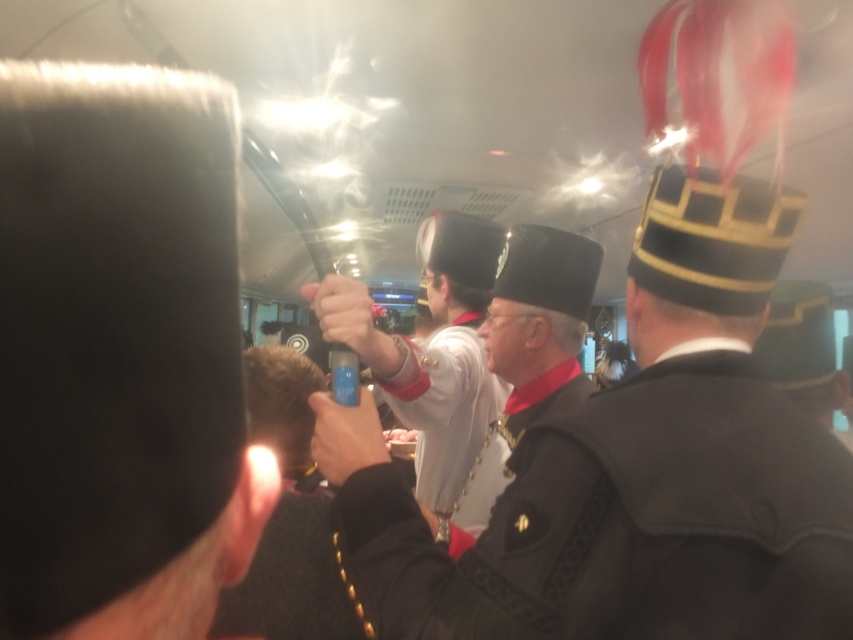
Question: Does metallic silver can at center have a larger size compared to black matte uniform at center?

Choices:
 (A) no
 (B) yes

Answer: (B)

Question: Is metallic silver can at center to the right of black felt hat at center from the viewer's perspective?

Choices:
 (A) yes
 (B) no

Answer: (B)

Question: Which of the following is the farthest from the observer?

Choices:
 (A) (321, 282)
 (B) (735, 289)

Answer: (A)

Question: Is black felt hat at center wider than matte black hat at center?

Choices:
 (A) no
 (B) yes

Answer: (A)

Question: Which object is the farthest from the black felt hat at center?

Choices:
 (A) metallic silver can at center
 (B) black fabric uniform at center
 (C) white matte uniform at center
 (D) black matte uniform at center

Answer: (B)

Question: Which point is farther from the camera taking this photo?

Choices:
 (A) (635, 452)
 (B) (569, 248)
 (C) (556, 406)

Answer: (B)